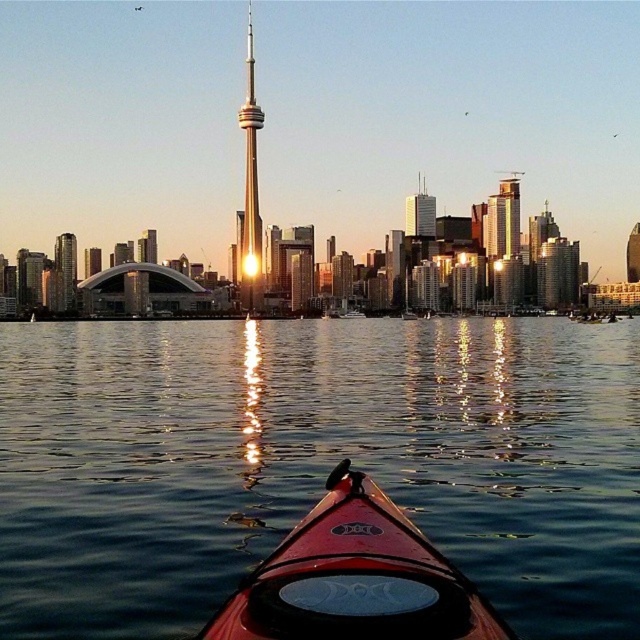
Question: Which object is closer to the camera taking this photo?

Choices:
 (A) gold reflective tower at center
 (B) glossy water at center
 (C) smooth glass skyscraper at right

Answer: (B)

Question: Is glossy water at center behind matte red canoe at center?

Choices:
 (A) yes
 (B) no

Answer: (A)

Question: Is gold reflective tower at center further to camera compared to glassy reflective skyscraper at left?

Choices:
 (A) no
 (B) yes

Answer: (B)

Question: Which object is positioned closest to the matte red canoe at center?

Choices:
 (A) smooth glass skyscraper at right
 (B) gold reflective tower at center

Answer: (B)

Question: Which point is closer to the camera?

Choices:
 (A) smooth glass skyscraper at right
 (B) matte red canoe at center

Answer: (B)

Question: Observing the image, what is the correct spatial positioning of gold reflective tower at center in reference to smooth glass skyscraper at right?

Choices:
 (A) left
 (B) right

Answer: (A)